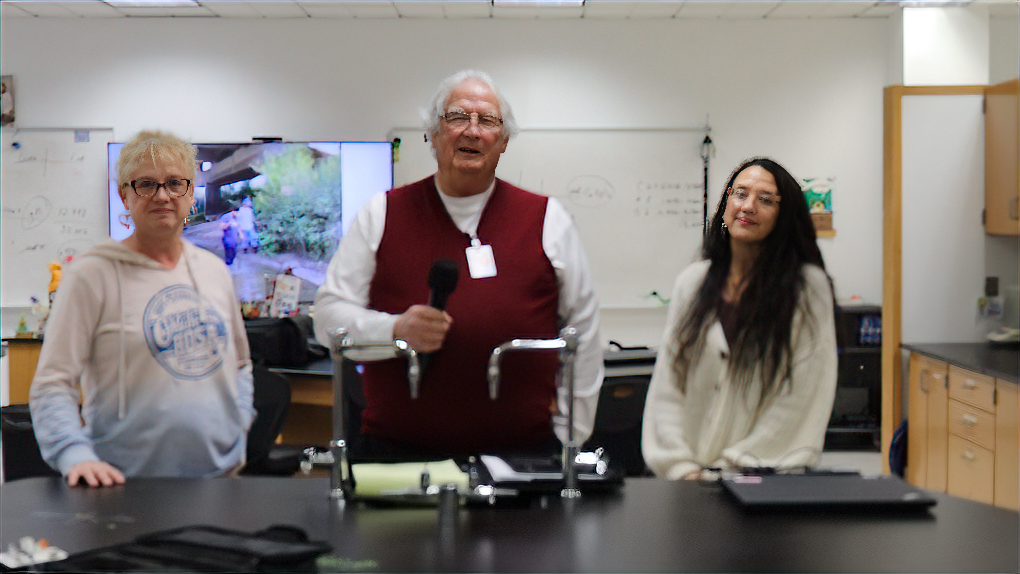
This screenshot has width=1020, height=574. Find the location of `white board`. white board is located at coordinates (559, 147), (356, 161), (61, 183).